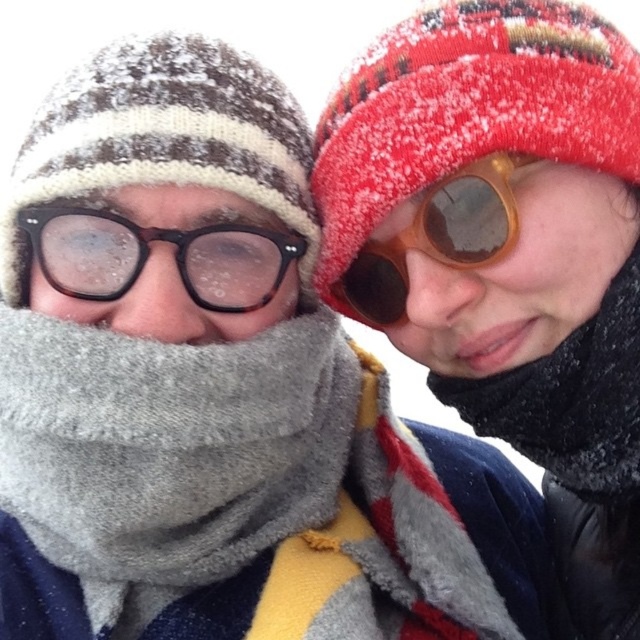
Question: Which object is positioned closest to the tortoiseshell plastic glasses at left?

Choices:
 (A) gray fleece scarf at center
 (B) brown wooden sunglasses at upper right

Answer: (B)

Question: Which object appears closest to the camera in this image?

Choices:
 (A) tortoiseshell plastic glasses at left
 (B) gray fleece scarf at center

Answer: (B)

Question: Can you confirm if gray fleece scarf at center is smaller than brown wooden sunglasses at upper right?

Choices:
 (A) no
 (B) yes

Answer: (A)

Question: Which object appears farthest from the camera in this image?

Choices:
 (A) gray fleece scarf at center
 (B) brown wooden sunglasses at upper right
 (C) tortoiseshell plastic glasses at left

Answer: (B)

Question: Does gray fleece scarf at center appear over tortoiseshell plastic glasses at left?

Choices:
 (A) yes
 (B) no

Answer: (B)

Question: Can you confirm if tortoiseshell plastic glasses at left is bigger than brown wooden sunglasses at upper right?

Choices:
 (A) yes
 (B) no

Answer: (B)